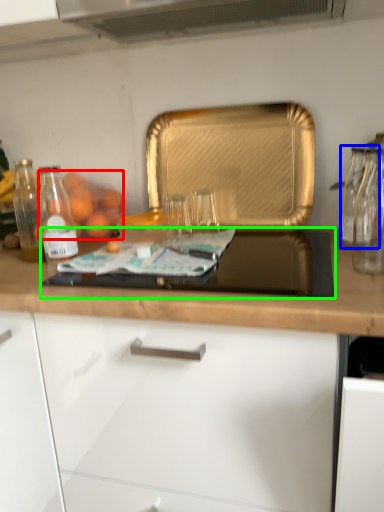
Question: Which is farther away from fruit (highlighted by a red box)? glass jar (highlighted by a blue box) or gas stove (highlighted by a green box)?

Choices:
 (A) glass jar
 (B) gas stove

Answer: (A)